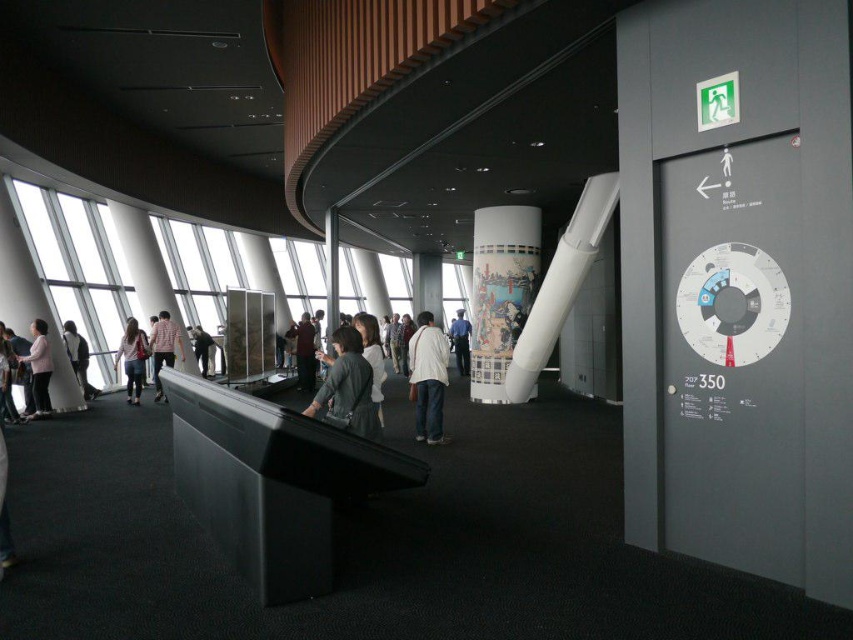
Question: Which point is farther to the camera?

Choices:
 (A) white plastic clock at right
 (B) dark gray jacket at center
 (C) white matte jacket at center

Answer: (B)

Question: Can you confirm if denim pants at left is positioned above dark blue jeans at center?

Choices:
 (A) no
 (B) yes

Answer: (A)

Question: Is light pink fabric at left to the left of dark gray jacket at center from the viewer's perspective?

Choices:
 (A) yes
 (B) no

Answer: (A)

Question: Which point is farther to the camera?

Choices:
 (A) (73, 339)
 (B) (416, 397)
 (C) (200, 371)
 (D) (32, 355)

Answer: (C)

Question: Does dark gray jacket at left have a smaller size compared to dark blue jeans at center?

Choices:
 (A) yes
 (B) no

Answer: (B)

Question: Which point is closer to the camera?

Choices:
 (A) white fabric jacket at center
 (B) dark blue jeans at center

Answer: (A)